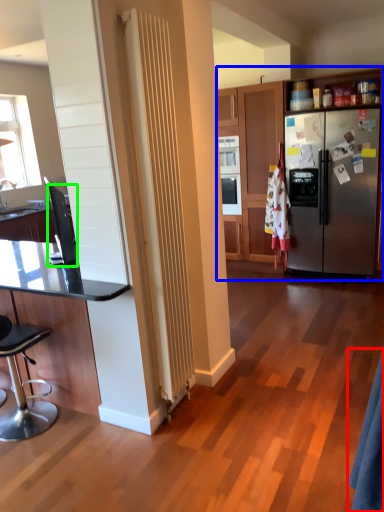
Question: Considering the real-world distances, which object is closest to robe (highlighted by a red box)? cabinetry (highlighted by a blue box) or appliance (highlighted by a green box).

Choices:
 (A) cabinetry
 (B) appliance

Answer: (B)